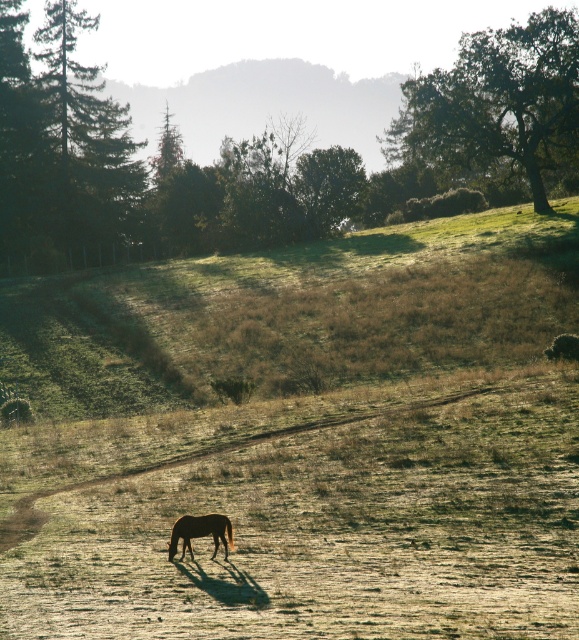
Between green leafy tree at upper right and brown glossy horse at center, which one is positioned higher?

Positioned higher is green leafy tree at upper right.

Between point (408, 118) and point (219, 531), which one is positioned behind?

Positioned behind is point (408, 118).

Where is `green leafy tree at upper right`? green leafy tree at upper right is located at coordinates (497, 104).